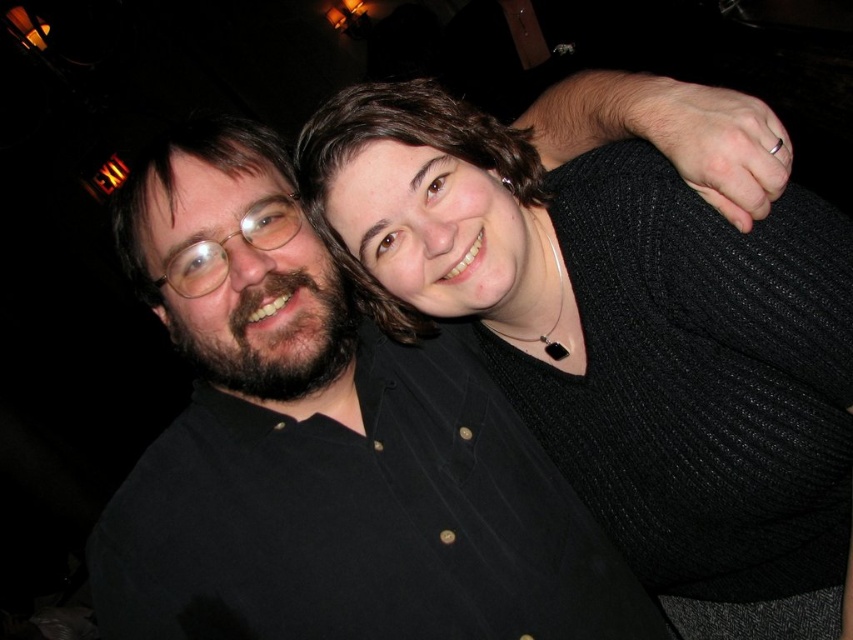
Question: Among these objects, which one is nearest to the camera?

Choices:
 (A) black matte shirt at center
 (B) black knitted sweater at upper right

Answer: (B)

Question: Does black knitted sweater at upper right appear over black matte shirt at center?

Choices:
 (A) yes
 (B) no

Answer: (A)

Question: Which point is farther to the camera?

Choices:
 (A) (782, 252)
 (B) (444, 520)

Answer: (B)

Question: In this image, where is black knitted sweater at upper right located relative to black matte shirt at center?

Choices:
 (A) below
 (B) above

Answer: (B)

Question: Can you confirm if black knitted sweater at upper right is positioned to the right of black matte shirt at center?

Choices:
 (A) no
 (B) yes

Answer: (B)